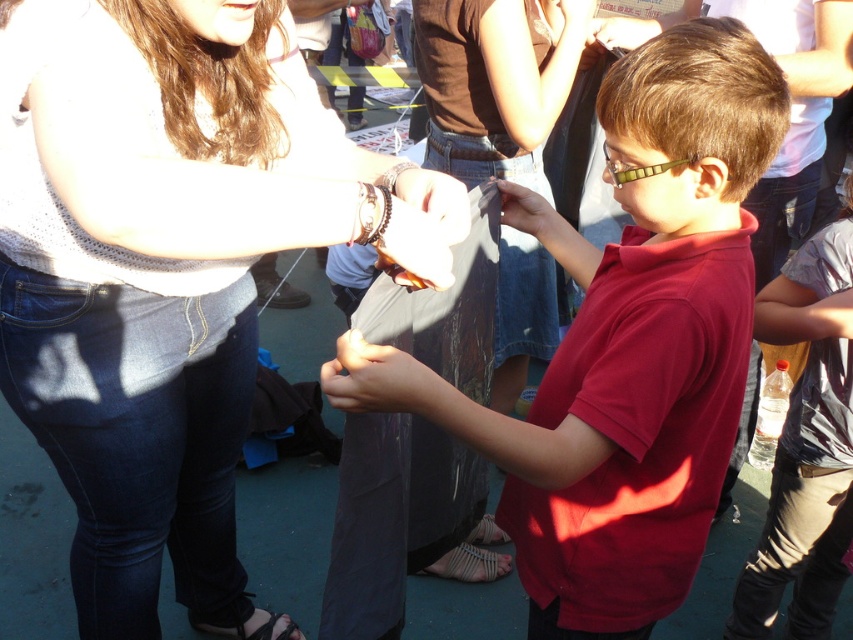
Question: Estimate the real-world distances between objects in this image. Which object is closer to the matte black umbrella at center?

Choices:
 (A) matte black phone at center
 (B) matte black shirt at center
 (C) knitted white sweater at upper left
 (D) white woven sandal at lower center

Answer: (B)

Question: Does matte black phone at center lie behind black leather sandal at lower left?

Choices:
 (A) no
 (B) yes

Answer: (A)

Question: Is knitted white sweater at upper left smaller than white woven sandal at lower center?

Choices:
 (A) yes
 (B) no

Answer: (B)

Question: Which of the following is the closest to the observer?

Choices:
 (A) (670, 58)
 (B) (212, 627)
 (C) (503, 534)
 (D) (363, 404)

Answer: (D)

Question: Does knitted white sweater at upper left have a larger size compared to black leather sandal at lower left?

Choices:
 (A) yes
 (B) no

Answer: (A)

Question: Among these objects, which one is nearest to the camera?

Choices:
 (A) matte black phone at center
 (B) matte black shirt at center

Answer: (A)